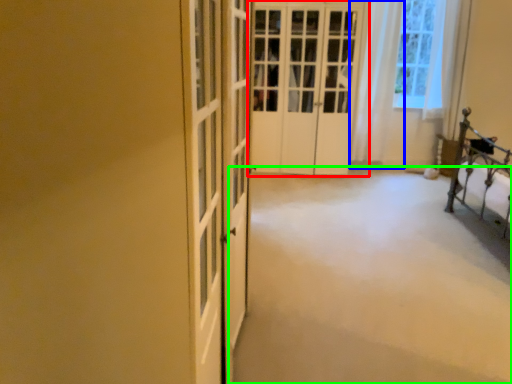
Question: Based on their relative distances, which object is nearer to door (highlighted by a red box)? Choose from curtain (highlighted by a blue box) and plain (highlighted by a green box).

Choices:
 (A) curtain
 (B) plain

Answer: (A)